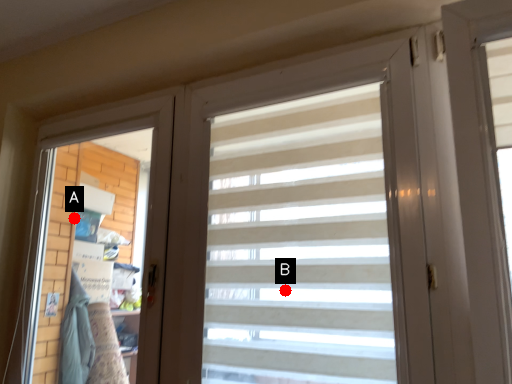
Question: Two points are circled on the image, labeled by A and B beside each circle. Which point appears closest to the camera in this image?

Choices:
 (A) A is closer
 (B) B is closer

Answer: (B)